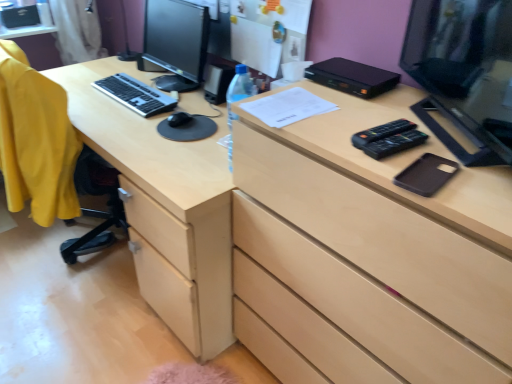
Find the location of a particular element. empty space that is ontop of light wood desk at center (from a real-world perspective) is located at coordinates (119, 92).